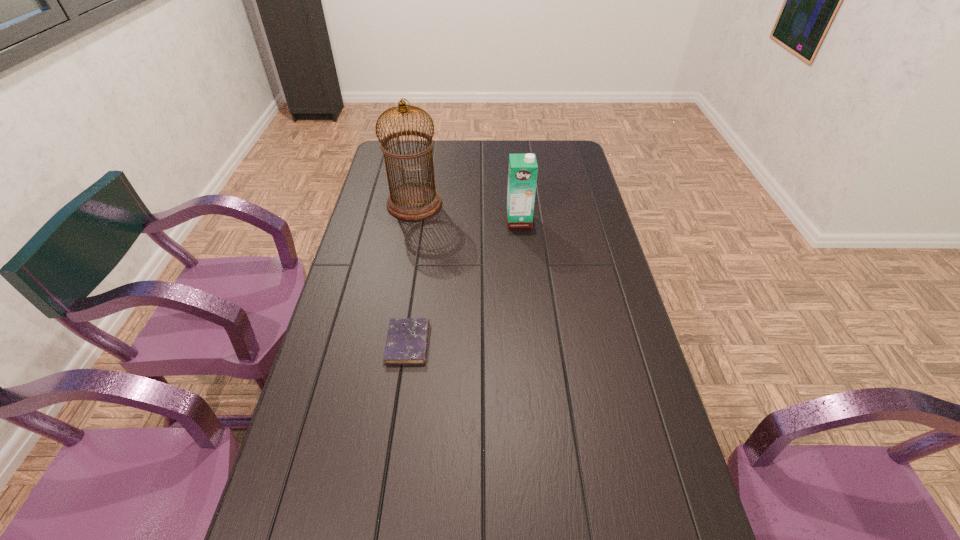
In the image, there is a desktop. Find the location of `vacant area at the left edge`. vacant area at the left edge is located at coordinates (x=381, y=261).

Identify the location of free space at the right edge of the desktop. (629, 484).

This screenshot has height=540, width=960. Identify the location of vacant area that lies between the nearest object and the rightmost object. (464, 282).

The image size is (960, 540). I want to click on blank region between the second shortest object and the nearest object, so click(x=464, y=282).

Where is `empty space that is in between the birdcage and the second tallest object`? Image resolution: width=960 pixels, height=540 pixels. empty space that is in between the birdcage and the second tallest object is located at coordinates (467, 212).

This screenshot has height=540, width=960. In order to click on vacant space that's between the second shortest object and the shortest object in this screenshot , I will do `click(464, 282)`.

You are a GUI agent. You are given a task and a screenshot of the screen. Output one action in this format:
    pyautogui.click(x=<x>, y=<y>)
    Task: Click on the vacant region between the shortest object and the second shortest object
    This screenshot has width=960, height=540.
    Given the screenshot: What is the action you would take?
    pyautogui.click(x=464, y=282)

This screenshot has width=960, height=540. In order to click on free point between the tallest object and the shortest object in this screenshot , I will do `click(411, 273)`.

At what (x,y) coordinates should I click in order to perform the action: click on free space between the nearest object and the birdcage. Please return your answer as a coordinate pair (x, y). The width and height of the screenshot is (960, 540). Looking at the image, I should click on (411, 273).

Where is `free space between the rightmost object and the nearest object`? free space between the rightmost object and the nearest object is located at coordinates (464, 282).